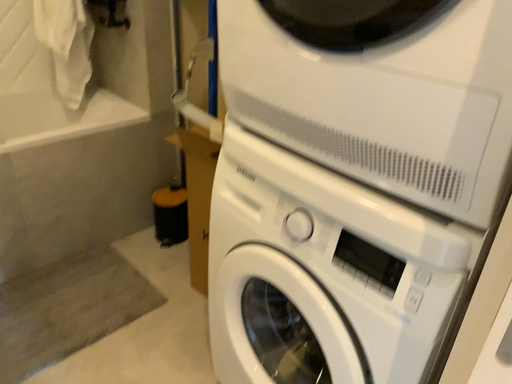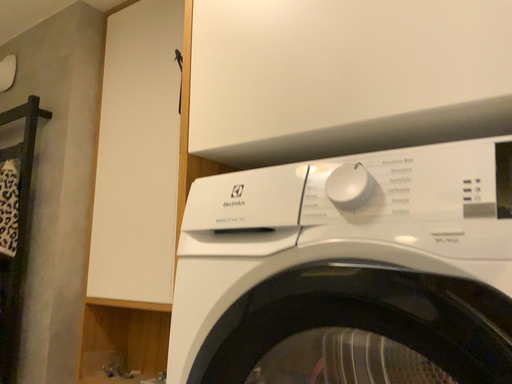
Question: Which way did the camera rotate in the video?

Choices:
 (A) rotated left
 (B) rotated right

Answer: (B)